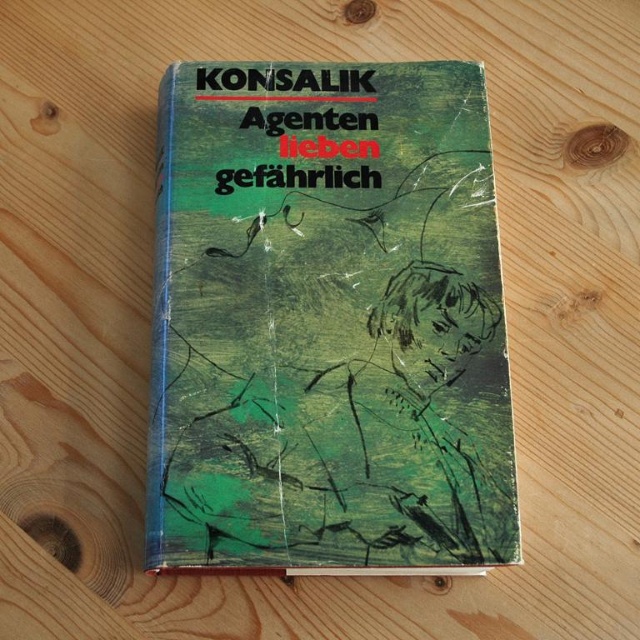
You are organizing a library shelf and need to ensure proper spacing between the green matte book at center and the black paper title at upper center. Since the black paper title is part of the book cover, how does their positioning affect the shelving arrangement?

The green matte book at center is located below the black paper title at upper center, which means the title is positioned higher up on the book cover. This arrangement ensures that when shelving the book, the title will be visible from above, making it easier to identify without needing to pull the book out.

You are organizing a bookshelf and need to ensure that the green matte book at center and the black paper title at upper center are placed in order from largest to smallest. Which object should come first?

The green matte book at center should come first since it is larger in size than the black paper title at upper center.